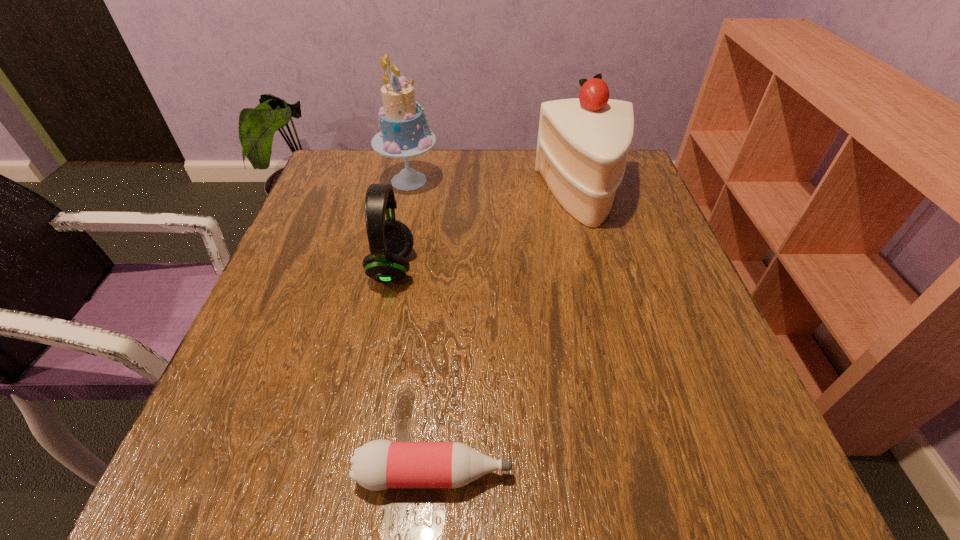
Identify the location of the tallest object. (404, 134).

Where is `the left cake`? the left cake is located at coordinates (404, 134).

Where is `the shorter cake`? Image resolution: width=960 pixels, height=540 pixels. the shorter cake is located at coordinates (582, 145).

Find the location of `the right cake`. the right cake is located at coordinates (582, 145).

Where is `headset`? This screenshot has width=960, height=540. headset is located at coordinates (390, 241).

Find the location of a particular element. the second shortest object is located at coordinates (390, 241).

Locate an element on the screen. The image size is (960, 540). bottle is located at coordinates (378, 465).

Identify the location of the nearest object. (378, 465).

Where is `free space located 0.050m with a ladder on the side of the tallest object`? The height and width of the screenshot is (540, 960). free space located 0.050m with a ladder on the side of the tallest object is located at coordinates (458, 181).

Where is `free space located 0.300m on the front of the rightmost object`? This screenshot has width=960, height=540. free space located 0.300m on the front of the rightmost object is located at coordinates (625, 339).